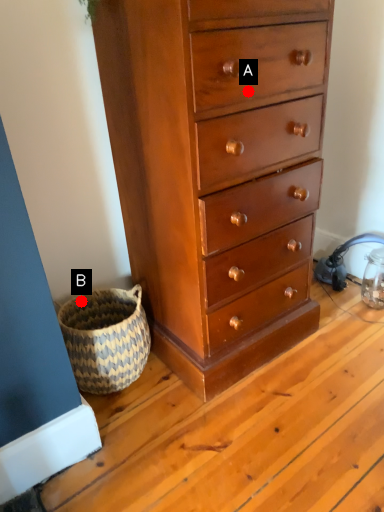
Question: Two points are circled on the image, labeled by A and B beside each circle. Which point is farther to the camera?

Choices:
 (A) A is further
 (B) B is further

Answer: (B)